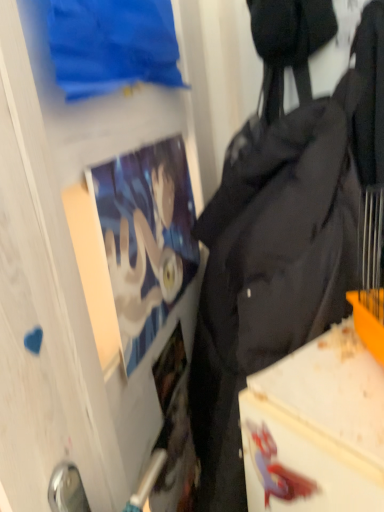
Question: Is matte paper poster at upper left situated inside transparent glass door at upper center or outside?

Choices:
 (A) outside
 (B) inside

Answer: (B)

Question: Considering their positions, is matte paper poster at upper left located in front of or behind transparent glass door at upper center?

Choices:
 (A) front
 (B) behind

Answer: (B)

Question: Considering the real-world distances, which object is closest to the black fabric backpack at right?

Choices:
 (A) matte paper poster at upper left
 (B) transparent glass door at upper center

Answer: (A)

Question: Which object is positioned farthest from the matte paper poster at upper left?

Choices:
 (A) black fabric backpack at right
 (B) transparent glass door at upper center

Answer: (B)